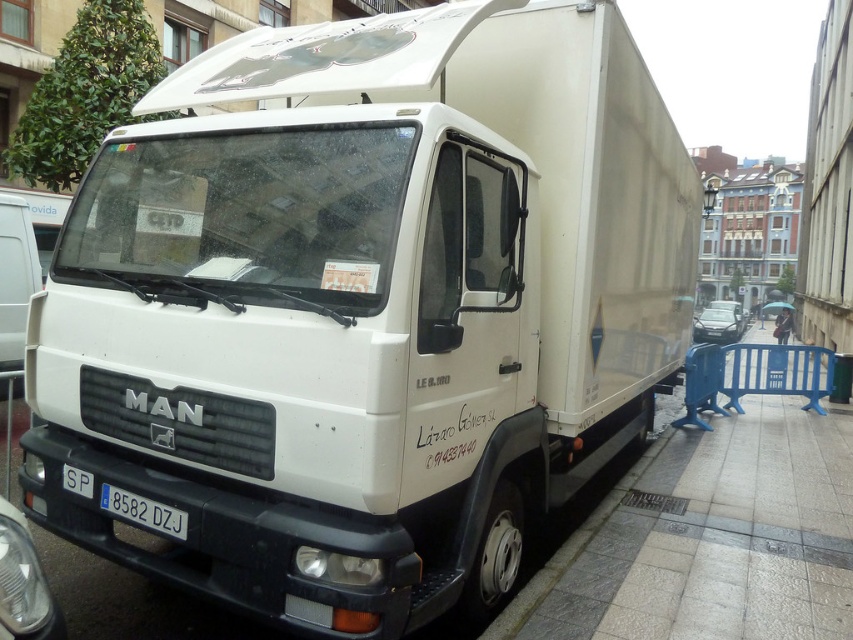
Question: Can you confirm if gray tile pavement at lower right is positioned above gray concrete curb at lower right?

Choices:
 (A) yes
 (B) no

Answer: (A)

Question: Which point is farther to the camera?

Choices:
 (A) white matte van at left
 (B) gray concrete curb at lower right
 (C) white plastic license plate at lower center

Answer: (A)

Question: Based on their relative distances, which object is nearer to the gray tile pavement at lower right?

Choices:
 (A) white matte van at left
 (B) white plastic license plate at lower center
 (C) gray concrete curb at lower right

Answer: (C)

Question: Is gray concrete curb at lower right below white plastic license plate at lower center?

Choices:
 (A) no
 (B) yes

Answer: (B)

Question: Which point is farther to the camera?

Choices:
 (A) gray tile pavement at lower right
 (B) white matte van at left

Answer: (B)

Question: Is gray tile pavement at lower right to the left of white matte van at left from the viewer's perspective?

Choices:
 (A) no
 (B) yes

Answer: (A)